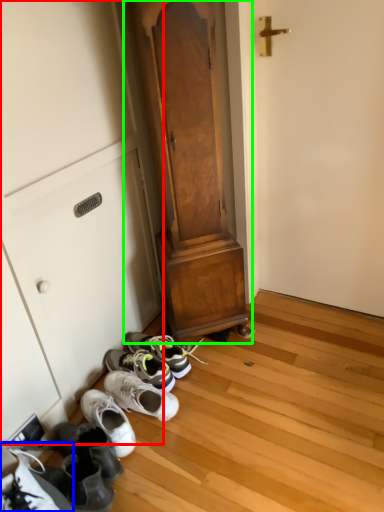
Question: Which object is the closest to the cabinetry (highlighted by a red box)? Choose among these: footwear (highlighted by a blue box) or dresser (highlighted by a green box).

Choices:
 (A) footwear
 (B) dresser

Answer: (B)